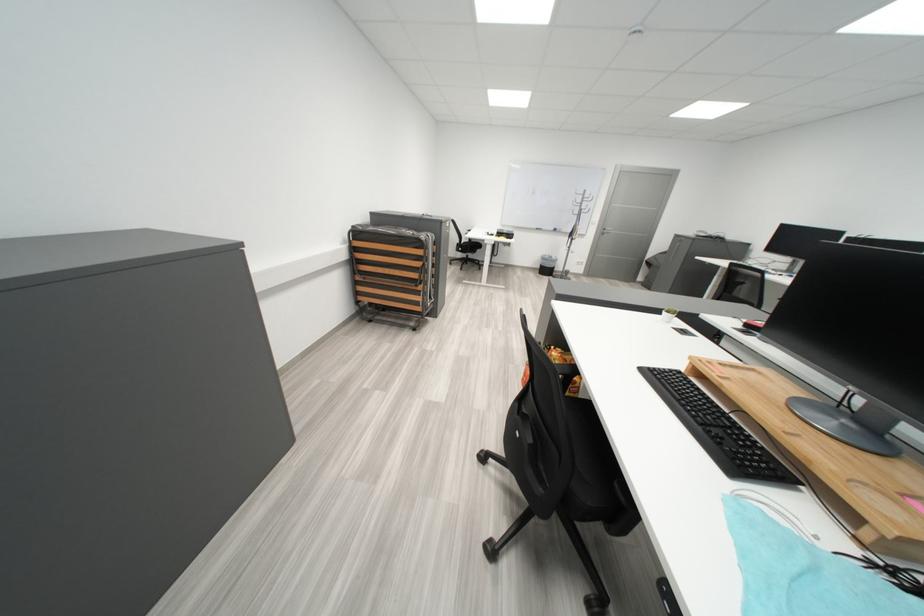
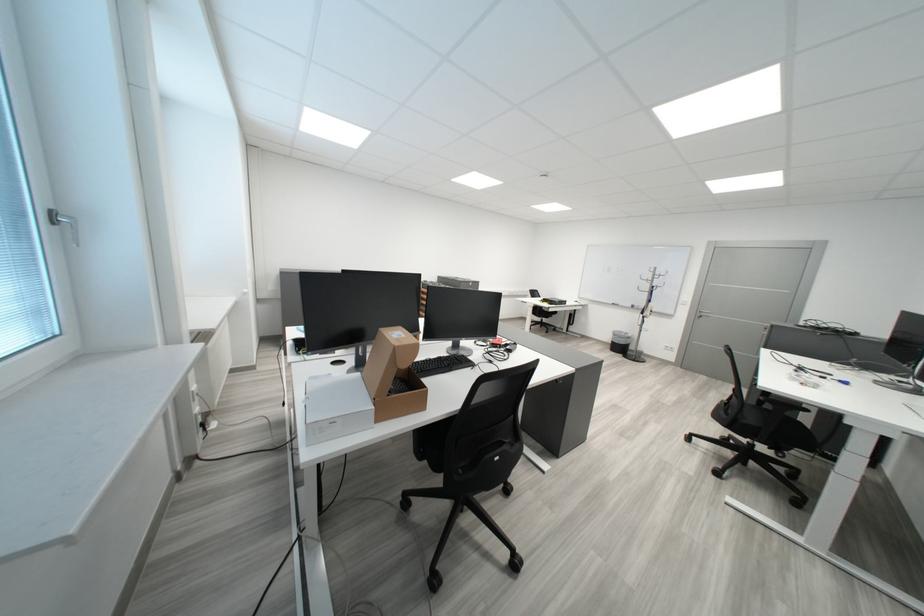
Locate, in the second image, the point that corresponds to (x=594, y=206) in the first image.

(665, 283)